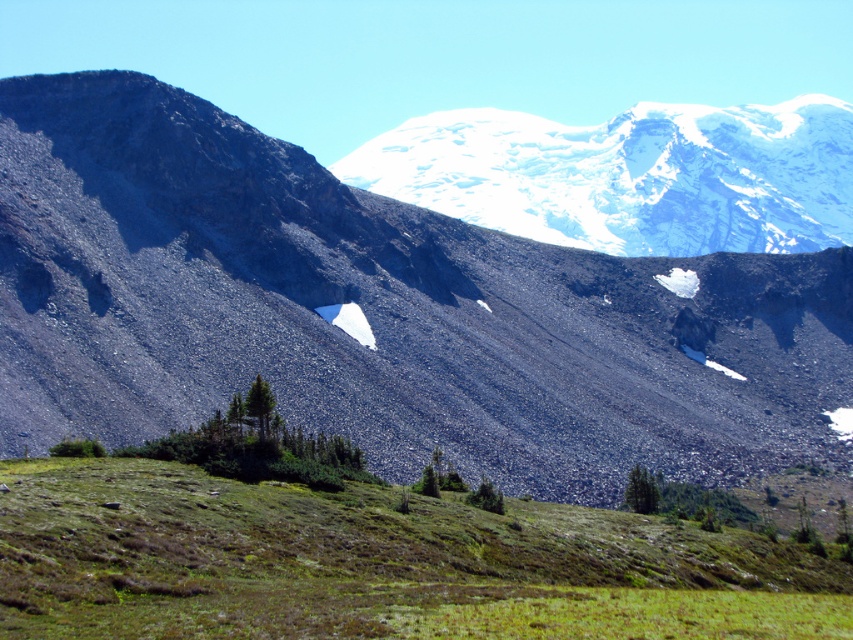
Consider the image. Is rocky gray mountain range at upper center taller than green grassy field at lower center?

Indeed, rocky gray mountain range at upper center has a greater height compared to green grassy field at lower center.

Can you confirm if rocky gray mountain range at upper center is positioned above green grassy field at lower center?

Correct, rocky gray mountain range at upper center is located above green grassy field at lower center.

In order to click on rocky gray mountain range at upper center in this screenshot , I will do `click(376, 310)`.

The height and width of the screenshot is (640, 853). In order to click on rocky gray mountain range at upper center in this screenshot , I will do `click(376, 310)`.

Can you confirm if rocky gray mountain range at upper center is smaller than white snow-covered mountain at upper center?

Yes.

Can you confirm if rocky gray mountain range at upper center is bigger than white snow-covered mountain at upper center?

No, rocky gray mountain range at upper center is not bigger than white snow-covered mountain at upper center.

Where is `rocky gray mountain range at upper center`? rocky gray mountain range at upper center is located at coordinates (376, 310).

This screenshot has width=853, height=640. In order to click on rocky gray mountain range at upper center in this screenshot , I will do [376, 310].

Measure the distance between green grassy field at lower center and white snow-covered mountain at upper center.

green grassy field at lower center and white snow-covered mountain at upper center are 261.04 meters apart from each other.

Between green grassy field at lower center and white snow-covered mountain at upper center, which one appears on the left side from the viewer's perspective?

From the viewer's perspective, green grassy field at lower center appears more on the left side.

Does point (376, 616) come closer to viewer compared to point (653, 227)?

Yes.

Locate an element on the screen. This screenshot has width=853, height=640. green grassy field at lower center is located at coordinates (376, 563).